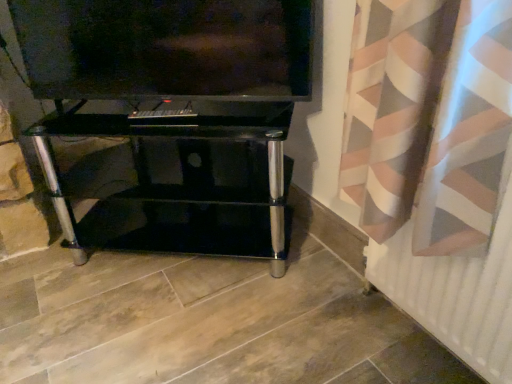
The image size is (512, 384). What are the coordinates of `black glass tv stand at center` in the screenshot? It's located at (182, 182).

Measure the distance between matte black tv at upper center and camera.

The distance of matte black tv at upper center from camera is 3.78 feet.

Measure the distance between point [435,267] and camera.

Point [435,267] and camera are 95.80 centimeters apart from each other.

You are a GUI agent. You are given a task and a screenshot of the screen. Output one action in this format:
    pyautogui.click(x=<x>, y=<y>)
    Task: Click on the black glass tv stand at center
    Image resolution: width=512 pixels, height=384 pixels.
    Given the screenshot: What is the action you would take?
    pyautogui.click(x=182, y=182)

Is white matte radiator at lower right facing away from matte black tv at upper center?

No.

Can you tell me how much white matte radiator at lower right and matte black tv at upper center differ in facing direction?

They differ by 51.4 degrees in their facing directions.

Is matte black tv at upper center surrounded by white matte radiator at lower right?

No, matte black tv at upper center is not surrounded by white matte radiator at lower right.

Looking at this image, is white matte radiator at lower right to the right of matte black tv at upper center from the viewer's perspective?

Correct, you'll find white matte radiator at lower right to the right of matte black tv at upper center.

How much distance is there between matte black tv at upper center and black glass tv stand at center?

A distance of 13.76 inches exists between matte black tv at upper center and black glass tv stand at center.

Considering the sizes of objects matte black tv at upper center and black glass tv stand at center in the image provided, who is shorter, matte black tv at upper center or black glass tv stand at center?

Standing shorter between the two is matte black tv at upper center.

Locate an element on the screen. This screenshot has width=512, height=384. furniture on the left side of matte black tv at upper center is located at coordinates (182, 182).

Are matte black tv at upper center and black glass tv stand at center located far from each other?

Actually, matte black tv at upper center and black glass tv stand at center are a little close together.

Between white matte radiator at lower right and black glass tv stand at center, which one has less height?

Standing shorter between the two is white matte radiator at lower right.

Is white matte radiator at lower right positioned with its back to black glass tv stand at center?

No.

Is point (425, 287) more distant than point (175, 238)?

No.

From a real-world perspective, is white matte radiator at lower right beneath black glass tv stand at center?

Yes, from a real-world perspective, white matte radiator at lower right is beneath black glass tv stand at center.

From a real-world perspective, is matte black tv at upper center above or below white matte radiator at lower right?

Clearly, from a real-world perspective, matte black tv at upper center is above white matte radiator at lower right.

Is the position of matte black tv at upper center more distant than that of white matte radiator at lower right?

Yes, it is behind white matte radiator at lower right.

Can you confirm if matte black tv at upper center is positioned to the right of white matte radiator at lower right?

No, matte black tv at upper center is not to the right of white matte radiator at lower right.

Which of these two, matte black tv at upper center or white matte radiator at lower right, stands shorter?

With less height is white matte radiator at lower right.

In the image, is black glass tv stand at center positioned in front of or behind matte black tv at upper center?

black glass tv stand at center is positioned farther from the viewer than matte black tv at upper center.

Identify the location of furniture on the left of matte black tv at upper center. Image resolution: width=512 pixels, height=384 pixels. (182, 182).

In the scene shown: From the image's perspective, between black glass tv stand at center and matte black tv at upper center, which one is located above?

From the image's view, matte black tv at upper center is above.

Is black glass tv stand at center positioned beyond the bounds of matte black tv at upper center?

black glass tv stand at center lies outside matte black tv at upper center's area.

Between black glass tv stand at center and white matte radiator at lower right, which one is positioned in front?

Positioned in front is white matte radiator at lower right.

In the scene shown: Can white matte radiator at lower right be found inside black glass tv stand at center?

No, black glass tv stand at center does not contain white matte radiator at lower right.

Who is bigger, black glass tv stand at center or white matte radiator at lower right?

black glass tv stand at center is bigger.

At what (x,y) coordinates should I click in order to perform the action: click on radiator below the matte black tv at upper center (from the image's perspective). Please return your answer as a coordinate pair (x, y). The image size is (512, 384). Looking at the image, I should click on (456, 290).

Where is `television in front of the black glass tv stand at center`? The image size is (512, 384). television in front of the black glass tv stand at center is located at coordinates (166, 48).

Which object lies further to the anchor point black glass tv stand at center, white matte radiator at lower right or matte black tv at upper center?

The object further to black glass tv stand at center is white matte radiator at lower right.

Looking at the image, which one is located further to matte black tv at upper center, white matte radiator at lower right or black glass tv stand at center?

Among the two, white matte radiator at lower right is located further to matte black tv at upper center.

Based on their spatial positions, is black glass tv stand at center or matte black tv at upper center closer to white matte radiator at lower right?

Based on the image, black glass tv stand at center appears to be nearer to white matte radiator at lower right.

Considering their positions, is matte black tv at upper center positioned further to white matte radiator at lower right than black glass tv stand at center?

matte black tv at upper center is positioned further to the anchor white matte radiator at lower right.

Based on the photo, looking at the image, which one is located closer to black glass tv stand at center, matte black tv at upper center or white matte radiator at lower right?

The object closer to black glass tv stand at center is matte black tv at upper center.

Estimate the real-world distances between objects in this image. Which object is further from matte black tv at upper center, black glass tv stand at center or white matte radiator at lower right?

white matte radiator at lower right is positioned further to the anchor matte black tv at upper center.

The image size is (512, 384). In order to click on television between black glass tv stand at center and white matte radiator at lower right in the horizontal direction in this screenshot , I will do `click(166, 48)`.